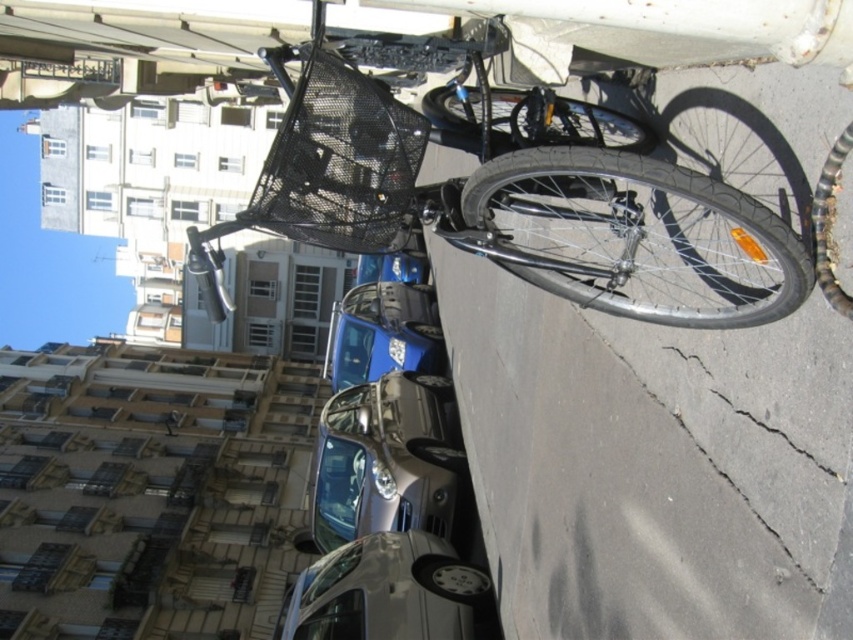
Question: Which point appears farthest from the camera in this image?

Choices:
 (A) (312, 502)
 (B) (352, 320)
 (C) (314, 196)

Answer: (B)

Question: Is shiny black bicycle at center in front of metallic blue car at center?

Choices:
 (A) yes
 (B) no

Answer: (A)

Question: Is shiny silver car at center bigger than silver metallic car at center?

Choices:
 (A) yes
 (B) no

Answer: (A)

Question: Estimate the real-world distances between objects in this image. Which object is farther from the metallic blue car at center?

Choices:
 (A) shiny black bicycle at center
 (B) silver metallic car at center
 (C) shiny silver car at center

Answer: (A)

Question: Which of these objects is positioned farthest from the shiny black bicycle at center?

Choices:
 (A) metallic blue car at center
 (B) shiny silver car at center
 (C) silver metallic car at center

Answer: (A)

Question: Observing the image, what is the correct spatial positioning of shiny black bicycle at center in reference to metallic blue car at center?

Choices:
 (A) left
 (B) right

Answer: (A)